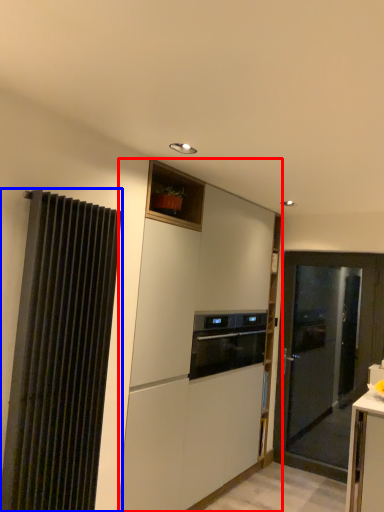
Question: Which object appears closest to the camera in this image, cabinetry (highlighted by a red box) or curtain (highlighted by a blue box)?

Choices:
 (A) cabinetry
 (B) curtain

Answer: (B)